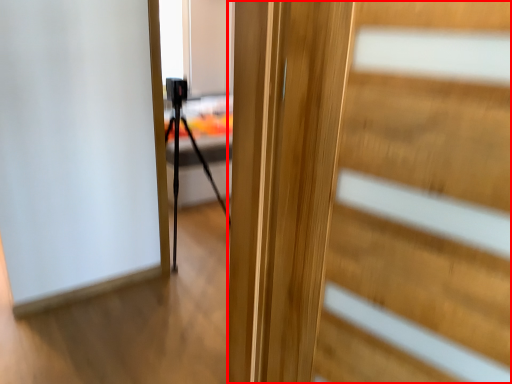
Question: From the image, what is the correct spatial relationship of door (annotated by the red box) in relation to tripod?

Choices:
 (A) right
 (B) left

Answer: (A)